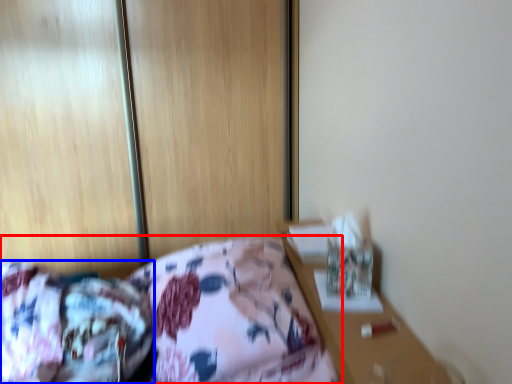
Question: Which object is closer to the camera taking this photo, bed (highlighted by a red box) or mattress (highlighted by a blue box)?

Choices:
 (A) bed
 (B) mattress

Answer: (B)